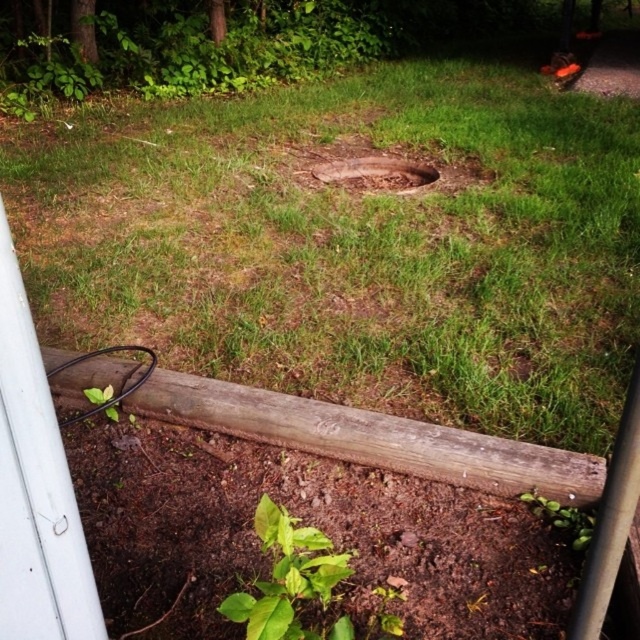
Question: Is green grass at center thinner than green leafy weed at lower center?

Choices:
 (A) no
 (B) yes

Answer: (A)

Question: Which point is closer to the camera taking this photo?

Choices:
 (A) (392, 172)
 (B) (262, 600)
 (C) (573, 253)
 (D) (589, 536)

Answer: (B)

Question: Which point is closer to the camera?

Choices:
 (A) (353, 170)
 (B) (273, 608)

Answer: (B)

Question: Is brown dirt hole at center above green leafy weed at lower center?

Choices:
 (A) yes
 (B) no

Answer: (A)

Question: Which of the following is the closest to the observer?

Choices:
 (A) green grass at center
 (B) green leafy weed at lower center
 (C) brown dirt hole at center

Answer: (B)

Question: Observing the image, what is the correct spatial positioning of green leafy plant at lower center in reference to green leafy weed at lower center?

Choices:
 (A) right
 (B) left

Answer: (B)